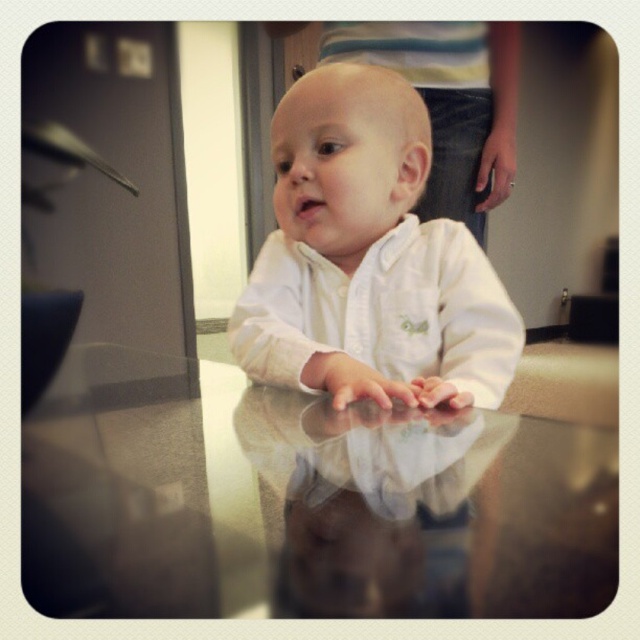
You are observing a baby sitting at a reflective surface. You notice two points marked on the image. The first point is at coordinates point (332,508) and the second point is at point (368,381). Which of these two points is nearer to you?

Point (332,508) is closer to the viewer than point (368,381).

You are a guest in a home and see the transparent glass table at center and the pink flesh at center. Which object is closer to the left side of the room?

The transparent glass table at center is to the left of the pink flesh at center, so the transparent glass table at center is closer to the left side of the room.

You are a robotic arm trying to grasp an object between the white glossy hands at center and the white matte hand at center. The robotic arm requires at least 5 inches of space to operate safely. Based on the scene, can the robotic arm safely operate in the space between these two objects?

The distance between the white glossy hands at center and the white matte hand at center is 4.08 inches, which is less than the required 5 inches. Therefore, the robotic arm cannot safely operate in that space.